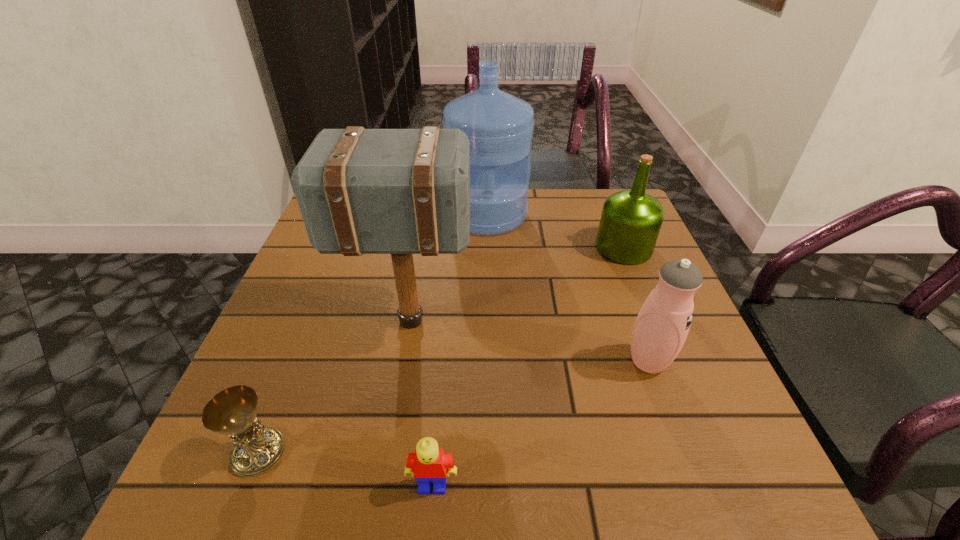
In order to click on water jug in this screenshot , I will do `click(500, 126)`.

Where is `mallet`? The width and height of the screenshot is (960, 540). mallet is located at coordinates (360, 191).

Image resolution: width=960 pixels, height=540 pixels. I want to click on olive oil, so click(x=630, y=222).

Identify the location of thermos bottle. The image size is (960, 540). (662, 325).

This screenshot has width=960, height=540. I want to click on chalice, so pyautogui.click(x=257, y=448).

The height and width of the screenshot is (540, 960). In order to click on Lego in this screenshot , I will do `click(428, 464)`.

Where is `vacant area situated on the side of the water jug with the handle`? This screenshot has width=960, height=540. vacant area situated on the side of the water jug with the handle is located at coordinates (490, 322).

The image size is (960, 540). Identify the location of vacant space located on the striking surface of the mallet. (516, 321).

The image size is (960, 540). Find the location of `free spot located on the left of the olive oil`. free spot located on the left of the olive oil is located at coordinates (501, 248).

The image size is (960, 540). Find the location of `free space located on the back of the thermos bottle`. free space located on the back of the thermos bottle is located at coordinates (616, 273).